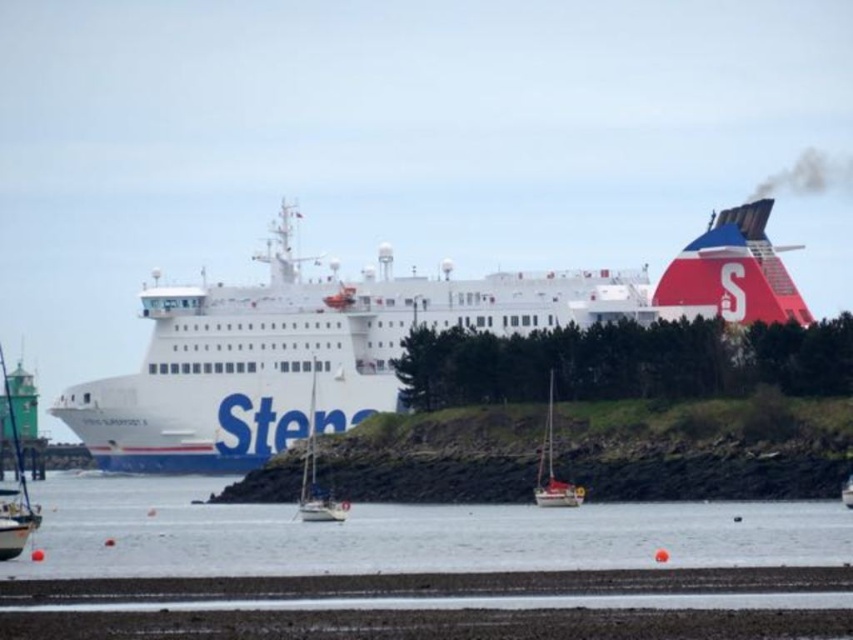
Question: Can you confirm if white matte cargo ship at center is thinner than clear water at center?

Choices:
 (A) yes
 (B) no

Answer: (B)

Question: Which object is the farthest from the clear water at center?

Choices:
 (A) white plastic sailboat at center
 (B) white glossy sailboat at center

Answer: (A)

Question: Is clear water at center further to camera compared to white plastic sailboat at center?

Choices:
 (A) yes
 (B) no

Answer: (B)

Question: Can you confirm if white matte cargo ship at center is smaller than white glossy sailboat at center?

Choices:
 (A) yes
 (B) no

Answer: (B)

Question: Which point appears farthest from the camera in this image?

Choices:
 (A) (579, 490)
 (B) (798, 554)

Answer: (A)

Question: Which of the following is the farthest from the observer?

Choices:
 (A) (556, 492)
 (B) (816, 550)
 (C) (154, 355)
 (D) (300, 516)

Answer: (C)